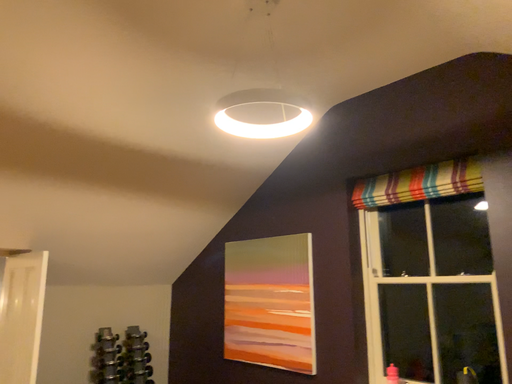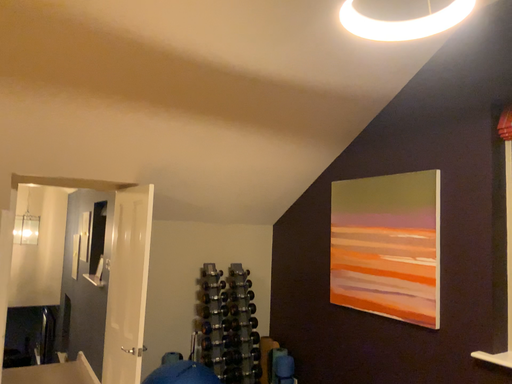
Question: How did the camera likely rotate when shooting the video?

Choices:
 (A) rotated downward
 (B) rotated upward

Answer: (A)